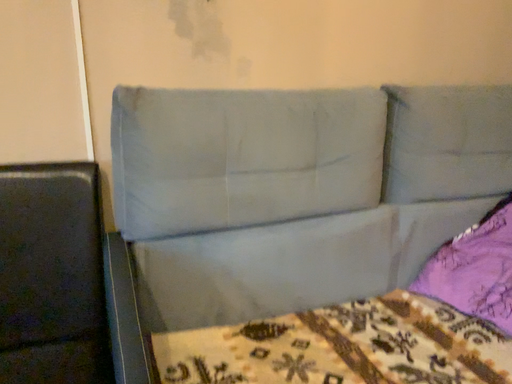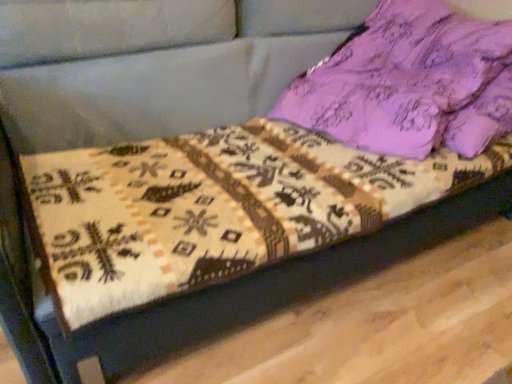
Question: How did the camera likely rotate when shooting the video?

Choices:
 (A) rotated right
 (B) rotated left

Answer: (A)